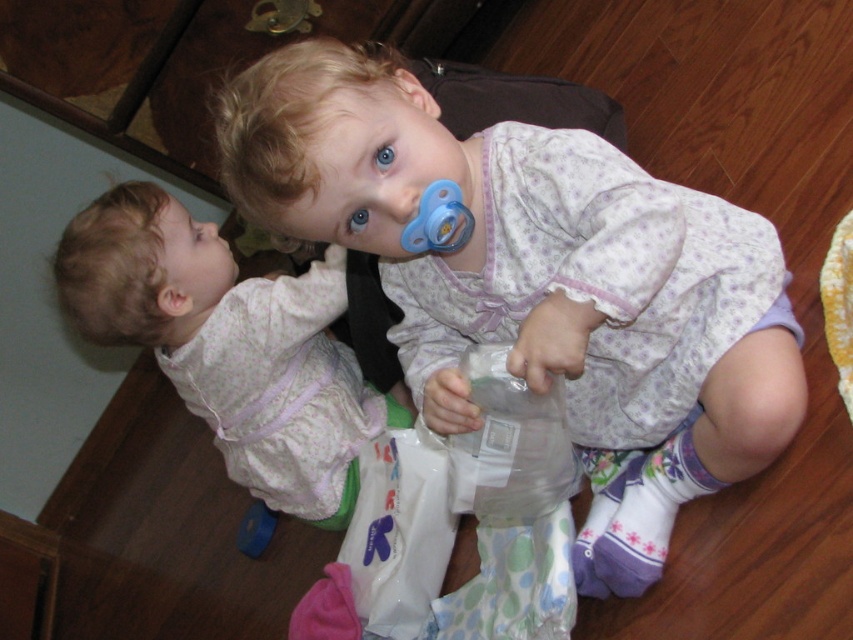
Question: Can you confirm if white cotton baby at center is wider than blue rubber toy at lower left?

Choices:
 (A) no
 (B) yes

Answer: (B)

Question: Which object appears farthest from the camera in this image?

Choices:
 (A) blue rubber pacifier at upper center
 (B) white cotton baby at center
 (C) blue rubber toy at lower left
 (D) transparent plastic bottle at center

Answer: (C)

Question: Which object is the closest to the blue rubber toy at lower left?

Choices:
 (A) transparent plastic bottle at center
 (B) blue rubber pacifier at upper center

Answer: (A)

Question: Can you confirm if white cotton baby at center is smaller than blue rubber toy at lower left?

Choices:
 (A) no
 (B) yes

Answer: (A)

Question: Which of the following is the closest to the observer?

Choices:
 (A) (477, 376)
 (B) (274, 524)
 (C) (460, 205)
 (D) (190, 387)

Answer: (C)

Question: Can you confirm if blue rubber pacifier at upper center is positioned to the right of blue rubber toy at lower left?

Choices:
 (A) yes
 (B) no

Answer: (A)